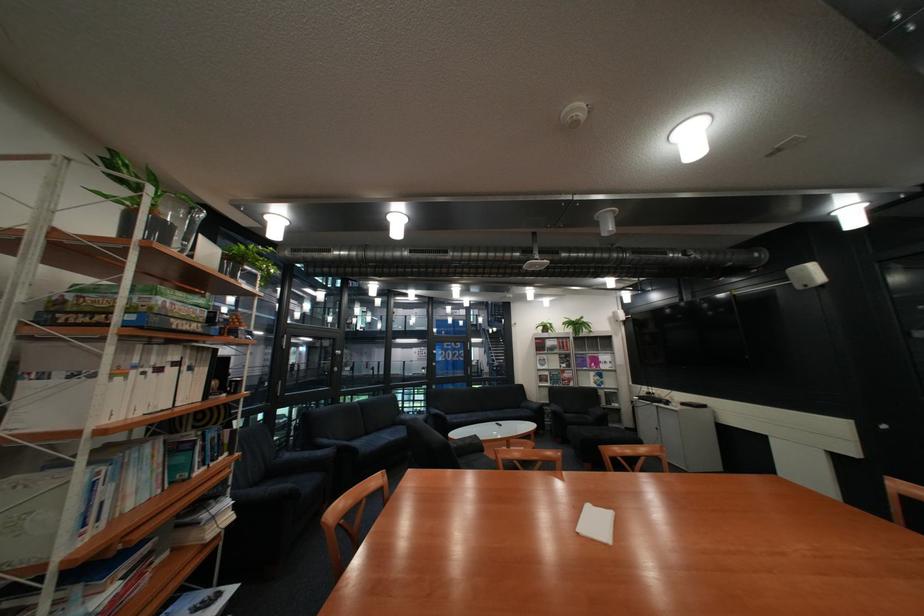
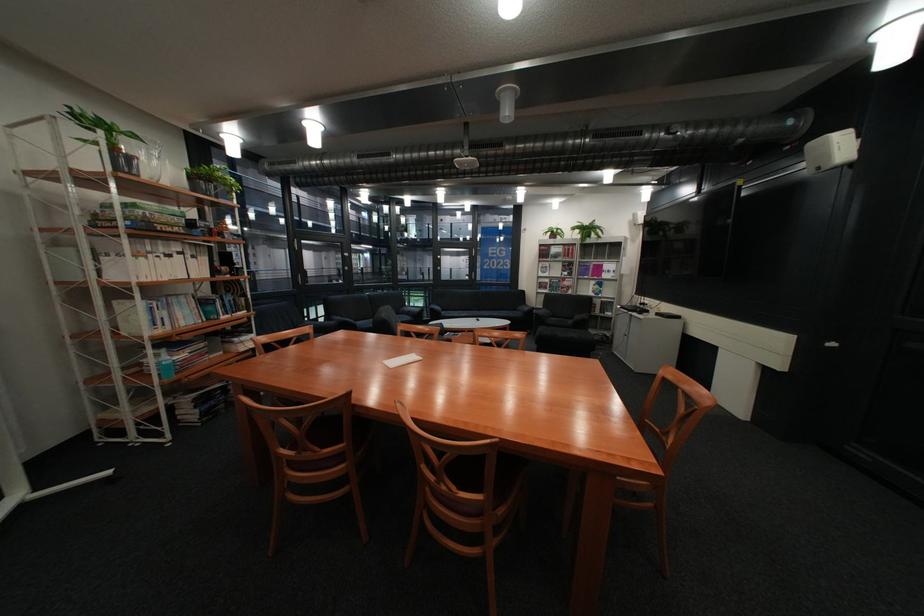
Where in the second image is the point corresponding to point (535, 408) from the first image?

(531, 310)